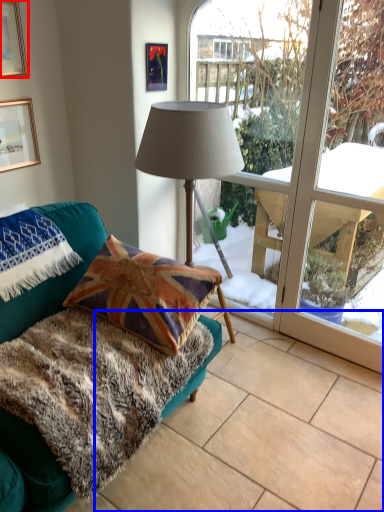
Question: Among these objects, which one is nearest to the camera, picture frame (highlighted by a red box) or tile (highlighted by a blue box)?

Choices:
 (A) picture frame
 (B) tile

Answer: (B)